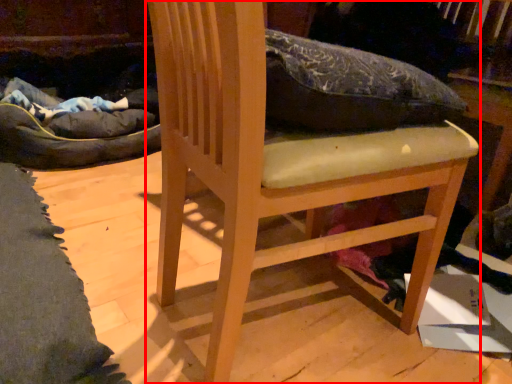
Question: Considering the relative positions of furniture (annotated by the red box) and cardboard box in the image provided, where is furniture (annotated by the red box) located with respect to the staircase?

Choices:
 (A) left
 (B) right

Answer: (A)